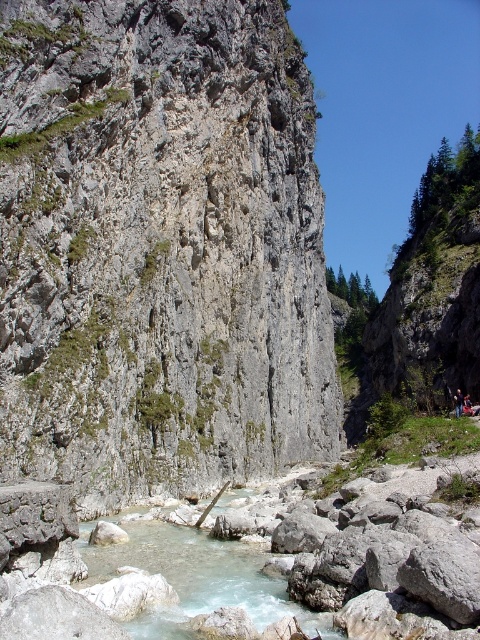
Does gray rough rock at center come behind clear quartz water at center?

Yes, it is.

Does gray rough rock at center appear under clear quartz water at center?

No.

Between point (95, 64) and point (244, 588), which one is positioned behind?

The point (95, 64) is more distant.

At what (x,y) coordinates should I click in order to perform the action: click on gray rough rock at center. Please return your answer as a coordinate pair (x, y). The height and width of the screenshot is (640, 480). Looking at the image, I should click on (158, 248).